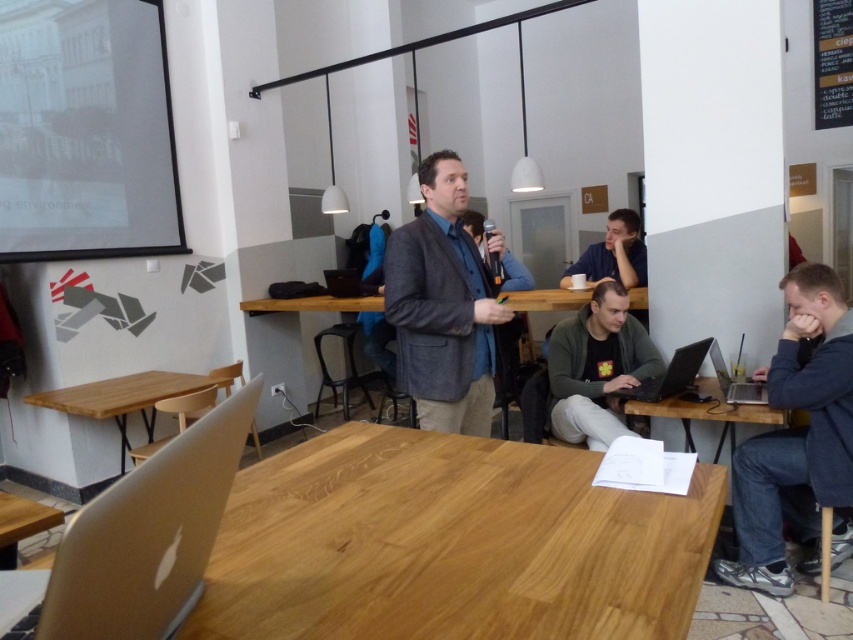
You are sitting at the natural wood table at center and want to pass a document to someone at the silver metallic laptop at lower right. Considering their positions, which direction should you move to reach them?

Since the natural wood table at center is closer to you than the silver metallic laptop at lower right, you should move forward to reach the silver metallic laptop at lower right.

You are sitting at the silver metallic laptop at lower right and want to pass a document to someone at the natural wood table at lower left. Which direction should you pass it?

You should pass the document to the left, as the natural wood table at lower left is located to the left of the silver metallic laptop at lower right.

You are organizing a small workshop and need to place a 1.2 meter long presentation board on the table. Given the sizes of the natural wood table at center and the silver metallic laptop at lower right, which table would be more suitable for placing the board without overcrowding?

The natural wood table at center has a larger size compared to the silver metallic laptop at lower right, so it would be more suitable for placing the 1.2 meter long presentation board without overcrowding.